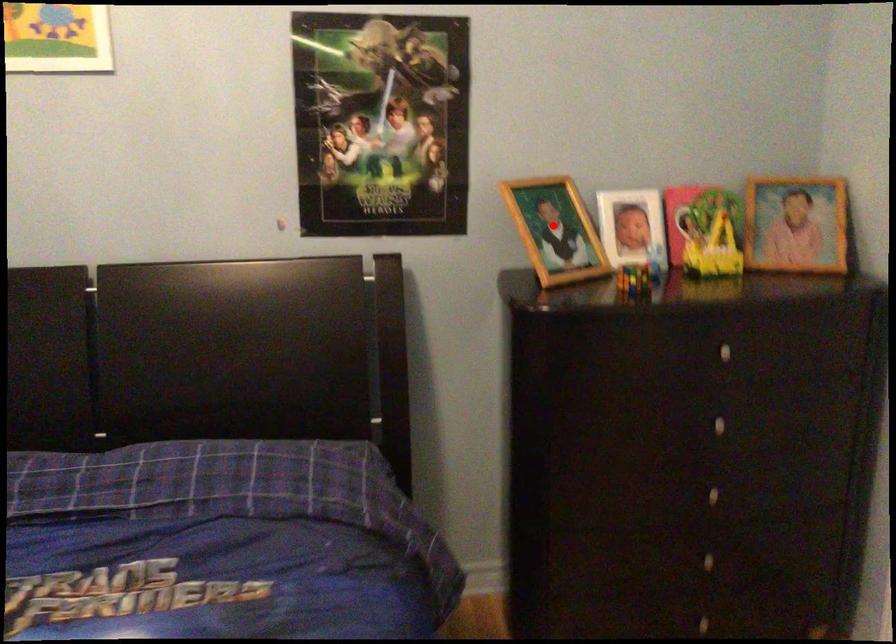
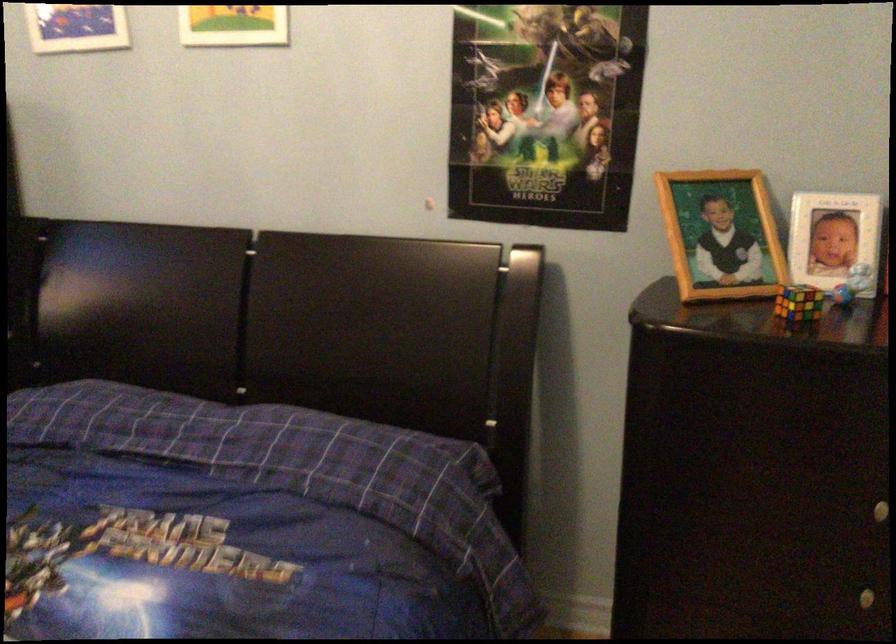
Question: I am providing you with two images of the same scene from different viewpoints. A red point is shown in image1. For the corresponding object point in image2, is it positioned nearer or farther from the camera?

Choices:
 (A) Nearer
 (B) Farther

Answer: (A)